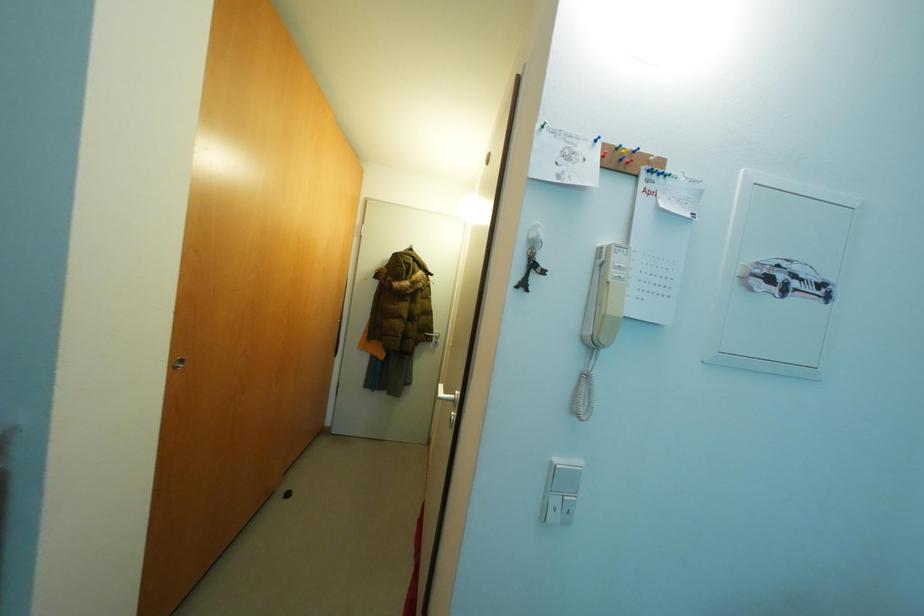
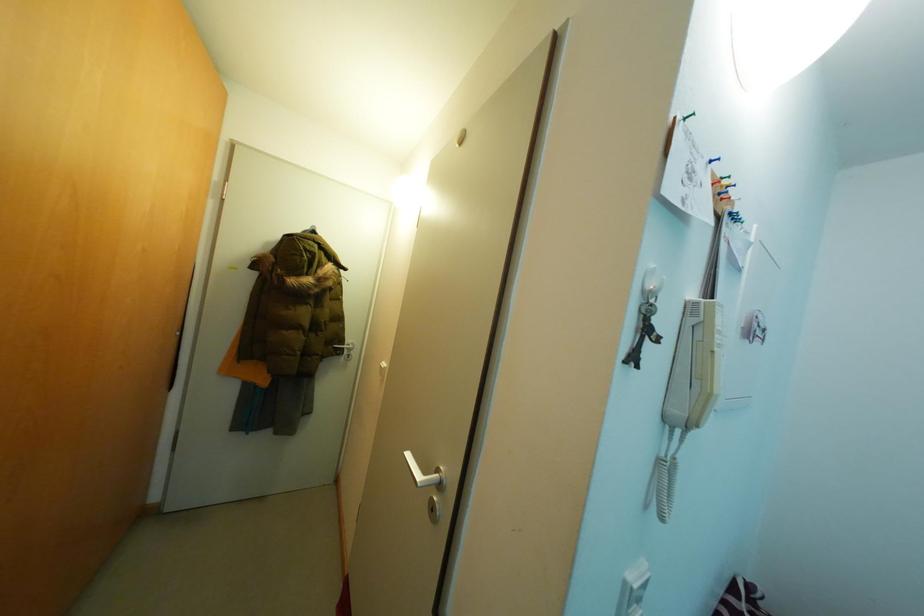
The images are taken continuously from a first-person perspective. In which direction are you moving?

The cameraman moved toward left, forward.